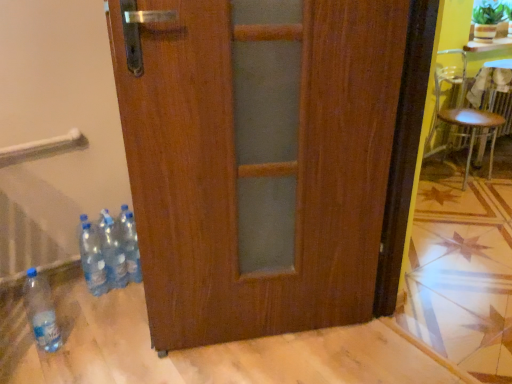
Where is `unoccupied area in front of transparent plastic bottle at lower left, positioned as the fourth bottle in right-to-left order`? The width and height of the screenshot is (512, 384). unoccupied area in front of transparent plastic bottle at lower left, positioned as the fourth bottle in right-to-left order is located at coordinates (37, 368).